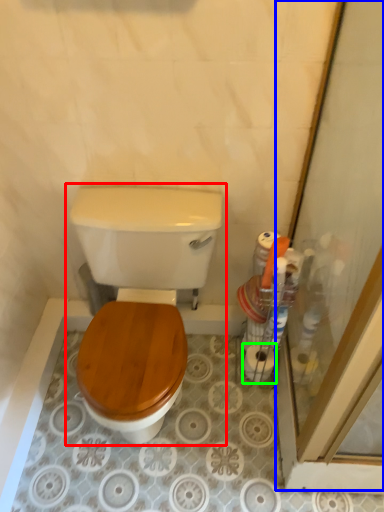
Question: Which is farther away from toilet (highlighted by a red box)? screen door (highlighted by a blue box) or toilet paper (highlighted by a green box)?

Choices:
 (A) screen door
 (B) toilet paper

Answer: (B)